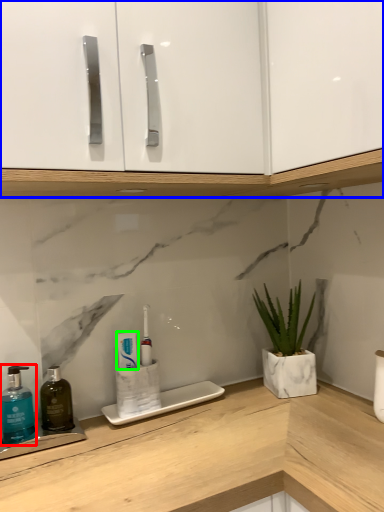
Question: Which is farther away from soap dispenser (highlighted by a red box)? cabinetry (highlighted by a blue box) or toothpaste (highlighted by a green box)?

Choices:
 (A) cabinetry
 (B) toothpaste

Answer: (A)